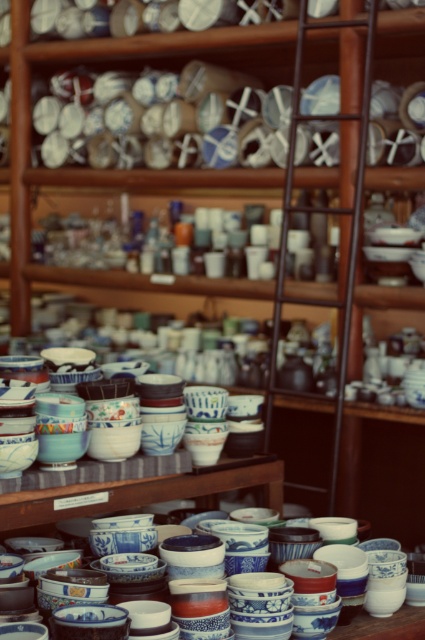
You are a customer in a ceramics shop and want to pick up the blue and white ceramic bowls at center and the blue glazed bowls at center. Which bowl set should you reach for first to grab the one closer to you?

The blue and white ceramic bowls at center is closer to you than the blue glazed bowls at center, so you should reach for the blue and white ceramic bowls at center first.

You are a customer at a pottery shop and want to choose a bowl that can hold more items. Based on the image, which bowl between the blue glazed bowls at center and the blue and white porcelain bowls at center would you select?

The blue glazed bowls at center are wider than the blue and white porcelain bowls at center, so they can hold more items.